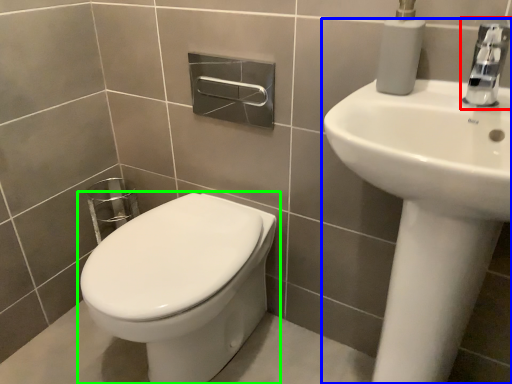
Question: Which is nearer to the tap (highlighted by a red box)? sink (highlighted by a blue box) or toilet (highlighted by a green box).

Choices:
 (A) sink
 (B) toilet

Answer: (A)